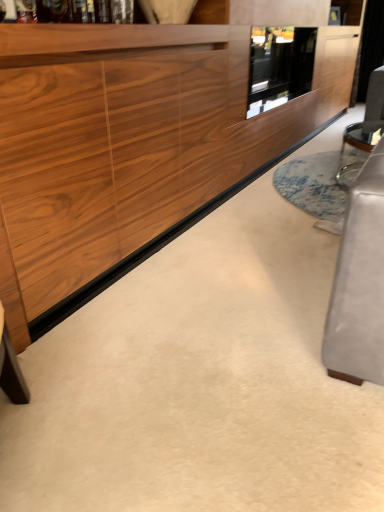
Question: Can you confirm if wooden cabinet at center is smaller than transparent glass door at upper center?

Choices:
 (A) yes
 (B) no

Answer: (B)

Question: Is wooden cabinet at center thinner than transparent glass door at upper center?

Choices:
 (A) no
 (B) yes

Answer: (A)

Question: Does wooden cabinet at center appear on the right side of transparent glass door at upper center?

Choices:
 (A) yes
 (B) no

Answer: (B)

Question: Is wooden cabinet at center wider than transparent glass door at upper center?

Choices:
 (A) yes
 (B) no

Answer: (A)

Question: Are wooden cabinet at center and transparent glass door at upper center making contact?

Choices:
 (A) no
 (B) yes

Answer: (A)

Question: Does wooden cabinet at center lie behind transparent glass door at upper center?

Choices:
 (A) yes
 (B) no

Answer: (B)

Question: Is the depth of transparent glass door at upper center greater than that of wooden cabinet at center?

Choices:
 (A) no
 (B) yes

Answer: (B)

Question: Does transparent glass door at upper center have a lesser height compared to wooden cabinet at center?

Choices:
 (A) yes
 (B) no

Answer: (A)

Question: Considering the relative sizes of transparent glass door at upper center and wooden cabinet at center in the image provided, is transparent glass door at upper center taller than wooden cabinet at center?

Choices:
 (A) no
 (B) yes

Answer: (A)

Question: Is transparent glass door at upper center next to wooden cabinet at center?

Choices:
 (A) yes
 (B) no

Answer: (B)

Question: Is transparent glass door at upper center oriented away from wooden cabinet at center?

Choices:
 (A) yes
 (B) no

Answer: (A)

Question: Does transparent glass door at upper center appear on the right side of wooden cabinet at center?

Choices:
 (A) no
 (B) yes

Answer: (B)

Question: Is wooden cabinet at center situated inside transparent glass door at upper center or outside?

Choices:
 (A) outside
 (B) inside

Answer: (A)